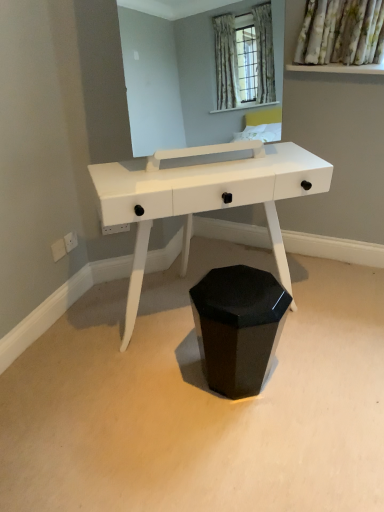
The width and height of the screenshot is (384, 512). Identify the location of free region on the left part of black glossy hexagonal waste bin at center. (172, 385).